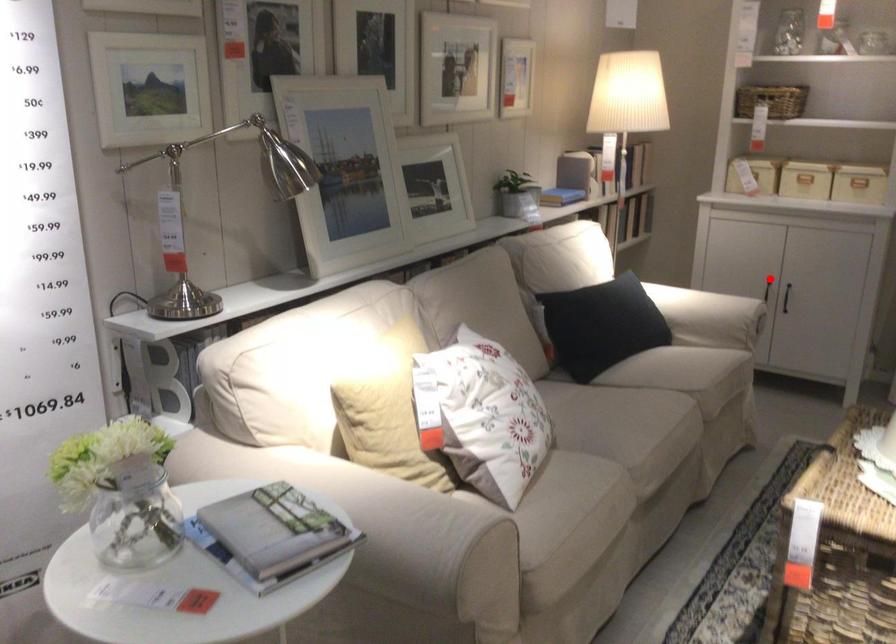
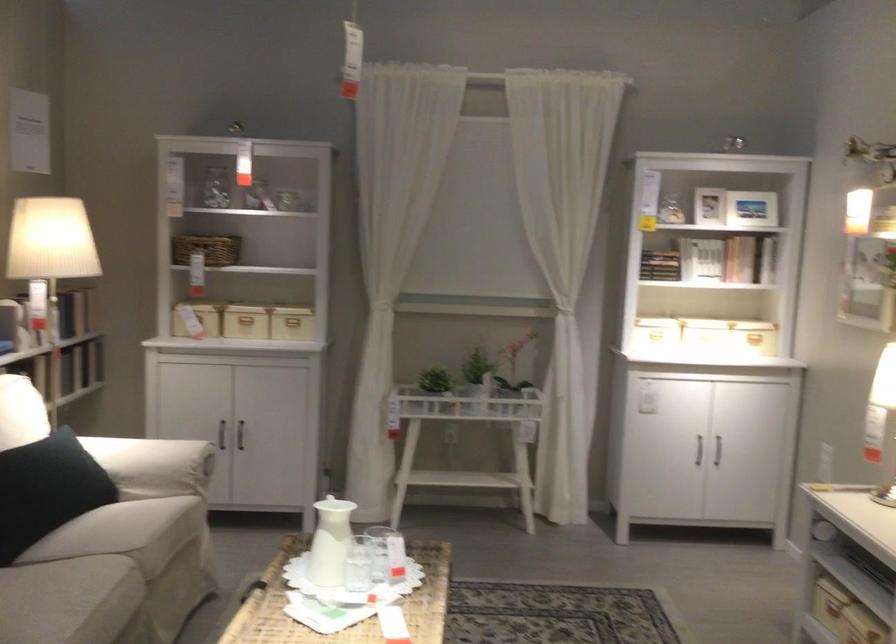
Locate, in the second image, the point that corresponds to the highlighted location in the first image.

(221, 433)